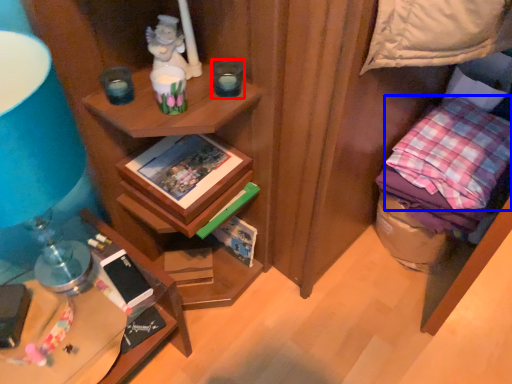
Question: Which object appears closest to the camera in this image, candle holder (highlighted by a red box) or pillow (highlighted by a blue box)?

Choices:
 (A) candle holder
 (B) pillow

Answer: (A)